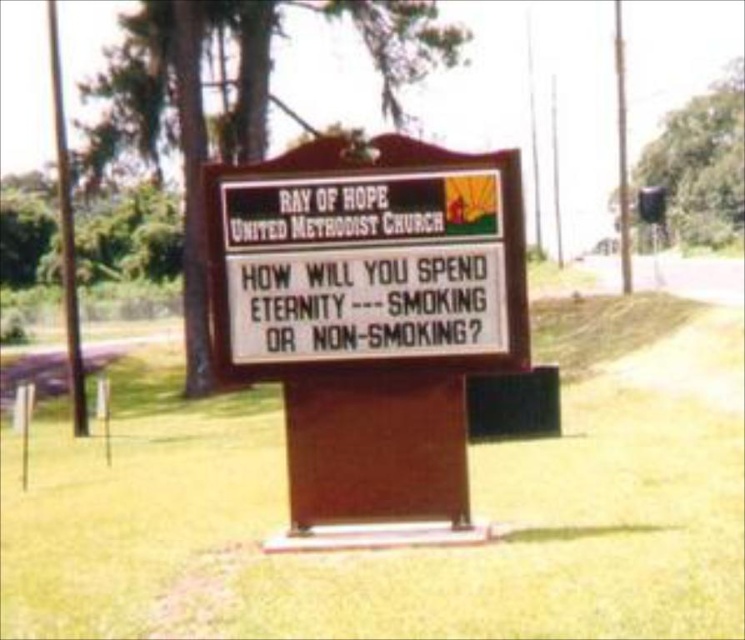
Can you confirm if green grass at center is wider than wooden signboard at center?

Indeed, green grass at center has a greater width compared to wooden signboard at center.

This screenshot has height=640, width=745. What do you see at coordinates (386, 550) in the screenshot? I see `green grass at center` at bounding box center [386, 550].

Which is in front, point (650, 416) or point (282, 296)?

Point (282, 296) is more forward.

Where is `green grass at center`? green grass at center is located at coordinates (386, 550).